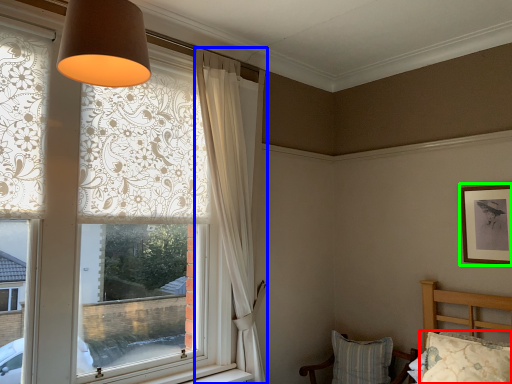
Question: Considering the real-world distances, which object is closest to pillow (highlighted by a red box)? curtain (highlighted by a blue box) or picture frame (highlighted by a green box).

Choices:
 (A) curtain
 (B) picture frame

Answer: (B)